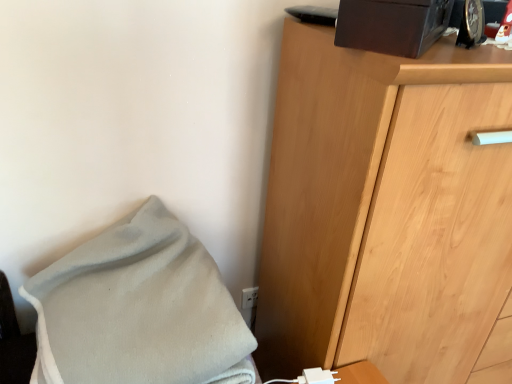
In order to face white plastic electric outlet at lower center, should I rotate leftwards or rightwards?

You should rotate left by 1.011 degrees.

What are the coordinates of `light brown wooden chest of drawers at right` in the screenshot? It's located at (384, 209).

At what (x,y) coordinates should I click in order to perform the action: click on white plastic electric outlet at lower center. Please return your answer as a coordinate pair (x, y). Looking at the image, I should click on 249,297.

Would you say light brown wooden chest of drawers at right is a long distance from white plastic electric outlet at lower center?

No, light brown wooden chest of drawers at right is in close proximity to white plastic electric outlet at lower center.

From the image's perspective, between light brown wooden chest of drawers at right and white plastic electric outlet at lower center, who is located below?

white plastic electric outlet at lower center appears lower in the image.

From a real-world perspective, which is physically above, light brown wooden chest of drawers at right or white plastic electric outlet at lower center?

light brown wooden chest of drawers at right, from a real-world perspective.

Is light brown wooden chest of drawers at right shorter than white fleece blanket at lower left?

Incorrect, the height of light brown wooden chest of drawers at right does not fall short of that of white fleece blanket at lower left.

From the image's perspective, between light brown wooden chest of drawers at right and white fleece blanket at lower left, who is located below?

white fleece blanket at lower left is shown below in the image.

Is the position of light brown wooden chest of drawers at right more distant than that of white fleece blanket at lower left?

That is True.

Which object is positioned more to the left, light brown wooden chest of drawers at right or white fleece blanket at lower left?

white fleece blanket at lower left is more to the left.

How different are the orientations of white plastic electric outlet at lower center and light brown wooden chest of drawers at right in degrees?

white plastic electric outlet at lower center and light brown wooden chest of drawers at right are facing 2.3 degrees away from each other.

From a real-world perspective, is white plastic electric outlet at lower center located beneath light brown wooden chest of drawers at right?

Yes.

Is white plastic electric outlet at lower center touching light brown wooden chest of drawers at right?

white plastic electric outlet at lower center is not next to light brown wooden chest of drawers at right, and they're not touching.

How distant is white plastic electric outlet at lower center from light brown wooden chest of drawers at right?

white plastic electric outlet at lower center is 24.21 inches away from light brown wooden chest of drawers at right.

Considering the points (183, 379) and (280, 275), which point is behind, point (183, 379) or point (280, 275)?

The point (280, 275) is farther from the camera.

Looking at this image, does white fleece blanket at lower left contain light brown wooden chest of drawers at right?

No, light brown wooden chest of drawers at right is not inside white fleece blanket at lower left.

Does white fleece blanket at lower left have a lesser height compared to light brown wooden chest of drawers at right?

Yes.

Is white fleece blanket at lower left positioned in front of white plastic electric outlet at lower center?

Yes.

In the image, there is a white plastic electric outlet at lower center. Identify the location of blanket above it (from the image's perspective). (137, 308).

Can you confirm if white fleece blanket at lower left is positioned to the left of white plastic electric outlet at lower center?

Indeed, white fleece blanket at lower left is positioned on the left side of white plastic electric outlet at lower center.

How different are the orientations of white plastic electric outlet at lower center and white fleece blanket at lower left in degrees?

The facing directions of white plastic electric outlet at lower center and white fleece blanket at lower left are 0.559 degrees apart.

Is white plastic electric outlet at lower center to the left of white fleece blanket at lower left from the viewer's perspective?

No, white plastic electric outlet at lower center is not to the left of white fleece blanket at lower left.

You are a GUI agent. You are given a task and a screenshot of the screen. Output one action in this format:
    pyautogui.click(x=<x>, y=<y>)
    Task: Click on the electric outlet below the white fleece blanket at lower left (from the image's perspective)
    The image size is (512, 384).
    Given the screenshot: What is the action you would take?
    pyautogui.click(x=249, y=297)

Which of these two, white plastic electric outlet at lower center or white fleece blanket at lower left, stands taller?

With more height is white fleece blanket at lower left.

Image resolution: width=512 pixels, height=384 pixels. I want to click on electric outlet on the left of light brown wooden chest of drawers at right, so click(x=249, y=297).

Identify the location of the chest of drawers that is under the white fleece blanket at lower left (from a real-world perspective). (384, 209).

Estimate the real-world distances between objects in this image. Which object is closer to light brown wooden chest of drawers at right, white plastic electric outlet at lower center or white fleece blanket at lower left?

white fleece blanket at lower left.

From the image, which object appears to be farther from white fleece blanket at lower left, light brown wooden chest of drawers at right or white plastic electric outlet at lower center?

white plastic electric outlet at lower center is positioned further to the anchor white fleece blanket at lower left.

Considering their positions, is light brown wooden chest of drawers at right positioned closer to white plastic electric outlet at lower center than white fleece blanket at lower left?

white fleece blanket at lower left lies closer to white plastic electric outlet at lower center than the other object.

From the image, which object appears to be farther from light brown wooden chest of drawers at right, white fleece blanket at lower left or white plastic electric outlet at lower center?

white plastic electric outlet at lower center is further to light brown wooden chest of drawers at right.

Based on their spatial positions, is white fleece blanket at lower left or light brown wooden chest of drawers at right closer to white plastic electric outlet at lower center?

white fleece blanket at lower left is positioned closer to the anchor white plastic electric outlet at lower center.

Which object lies further to the anchor point white fleece blanket at lower left, white plastic electric outlet at lower center or light brown wooden chest of drawers at right?

The object further to white fleece blanket at lower left is white plastic electric outlet at lower center.

The width and height of the screenshot is (512, 384). What are the coordinates of `electric outlet between white fleece blanket at lower left and light brown wooden chest of drawers at right from left to right` in the screenshot? It's located at (249, 297).